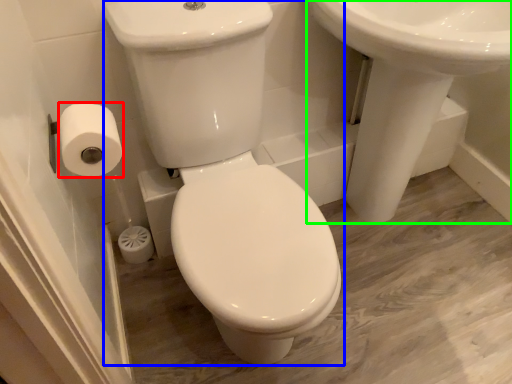
Question: Considering the real-world distances, which object is farthest from toilet paper (highlighted by a red box)? porcelain (highlighted by a blue box) or sink (highlighted by a green box)?

Choices:
 (A) porcelain
 (B) sink

Answer: (B)